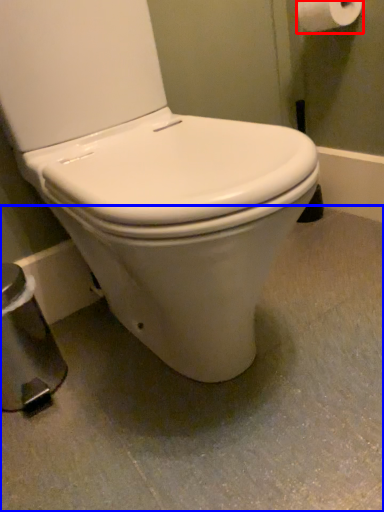
Question: Which of the following is the farthest to the observer, toilet paper (highlighted by a red box) or concrete (highlighted by a blue box)?

Choices:
 (A) toilet paper
 (B) concrete

Answer: (A)